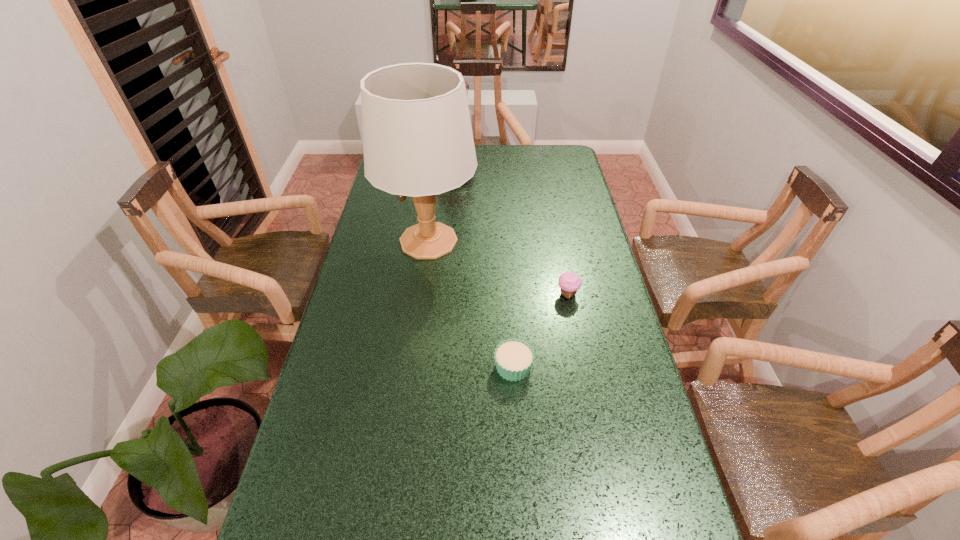
Locate an element on the screen. This screenshot has width=960, height=540. vacant area situated on the left of the second shortest object is located at coordinates (509, 294).

The width and height of the screenshot is (960, 540). In order to click on free space located on the right of the second object from right to left in this screenshot , I will do `click(570, 367)`.

Identify the location of object that is at the far edge. This screenshot has height=540, width=960. (466, 85).

Locate an element on the screen. The height and width of the screenshot is (540, 960). object that is at the left edge is located at coordinates (417, 136).

Find the location of a particular element. object at the right edge is located at coordinates (569, 282).

You are a GUI agent. You are given a task and a screenshot of the screen. Output one action in this format:
    pyautogui.click(x=<x>, y=<y>)
    Task: Click on the vacant space at the far edge of the desktop
    This screenshot has height=540, width=960.
    Given the screenshot: What is the action you would take?
    pyautogui.click(x=530, y=153)

The height and width of the screenshot is (540, 960). In order to click on vacant area at the left edge of the desktop in this screenshot , I will do `click(361, 358)`.

Locate an element on the screen. The height and width of the screenshot is (540, 960). free spot at the right edge of the desktop is located at coordinates (623, 377).

This screenshot has width=960, height=540. In the image, there is a desktop. In order to click on vacant space at the far right corner in this screenshot , I will do `click(547, 167)`.

At what (x,y) coordinates should I click in order to perform the action: click on vacant space that is in between the taller cupcake and the left cupcake. Please return your answer as a coordinate pair (x, y). Looking at the image, I should click on (540, 330).